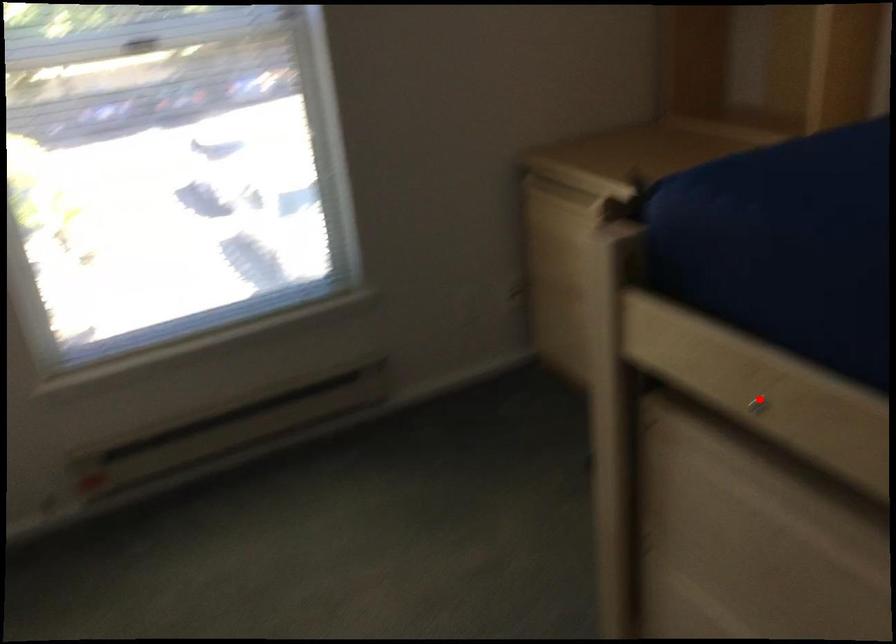
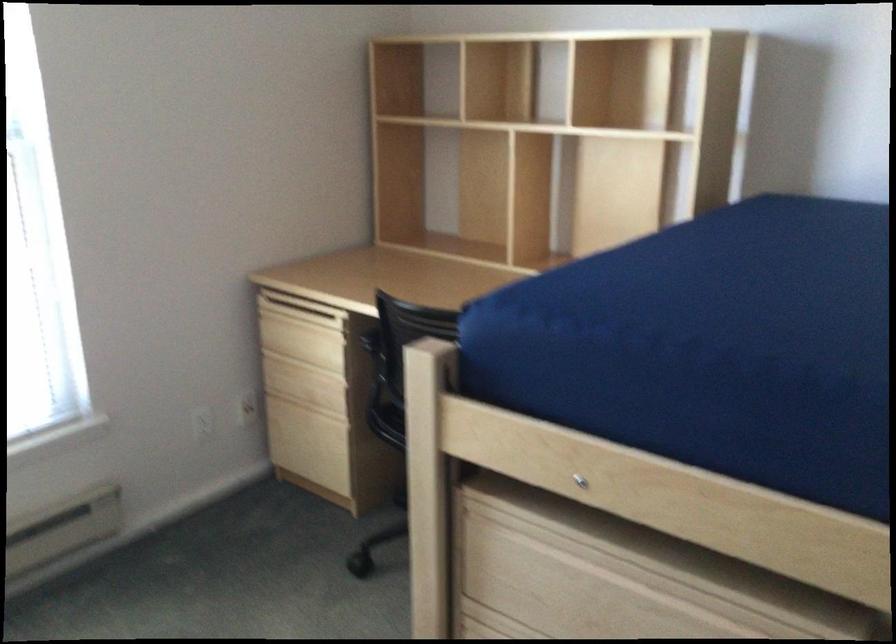
Question: I am providing you with two images of the same scene from different viewpoints. A red point is shown in image1. For the corresponding object point in image2, is it positioned nearer or farther from the camera?

Choices:
 (A) Nearer
 (B) Farther

Answer: (B)